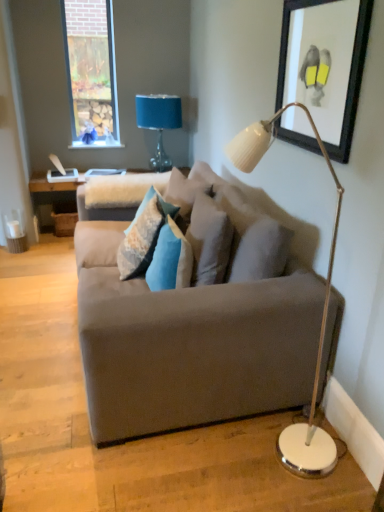
Question: From the image's perspective, is textured gray pillow at center, the first pillow in the right-to-left sequence, under blue fabric lampshade at upper center?

Choices:
 (A) no
 (B) yes

Answer: (B)

Question: Would you consider textured gray pillow at center, which appears as the 3th pillow when viewed from the left, to be distant from blue fabric lampshade at upper center?

Choices:
 (A) no
 (B) yes

Answer: (B)

Question: Is textured gray pillow at center, the first pillow in the right-to-left sequence, further to the viewer compared to blue fabric lampshade at upper center?

Choices:
 (A) no
 (B) yes

Answer: (A)

Question: Is the position of textured gray pillow at center, which appears as the 3th pillow when viewed from the left, less distant than that of blue fabric lampshade at upper center?

Choices:
 (A) no
 (B) yes

Answer: (B)

Question: Can you confirm if textured gray pillow at center, the first pillow in the right-to-left sequence, is bigger than blue fabric lampshade at upper center?

Choices:
 (A) no
 (B) yes

Answer: (A)

Question: Is textured gray pillow at center, which appears as the 3th pillow when viewed from the left, located outside blue fabric lampshade at upper center?

Choices:
 (A) no
 (B) yes

Answer: (B)

Question: From a real-world perspective, is suede gray couch at center positioned under blue velvet pillow at center, arranged as the 2th pillow when viewed from the left, based on gravity?

Choices:
 (A) yes
 (B) no

Answer: (A)

Question: Is suede gray couch at center turned away from blue velvet pillow at center, which is the 2th pillow from right to left?

Choices:
 (A) no
 (B) yes

Answer: (B)

Question: Can you confirm if suede gray couch at center is taller than blue velvet pillow at center, arranged as the 2th pillow when viewed from the left?

Choices:
 (A) no
 (B) yes

Answer: (B)

Question: Would you say suede gray couch at center is outside blue velvet pillow at center, arranged as the 2th pillow when viewed from the left?

Choices:
 (A) yes
 (B) no

Answer: (A)

Question: Does suede gray couch at center have a lesser height compared to blue velvet pillow at center, which is the 2th pillow from right to left?

Choices:
 (A) no
 (B) yes

Answer: (A)

Question: From the image's perspective, is suede gray couch at center below blue velvet pillow at center, which is the 2th pillow from right to left?

Choices:
 (A) no
 (B) yes

Answer: (A)

Question: Is white glossy floor lamp at right thinner than textured blue pillow at center, which ranks as the third pillow in right-to-left order?

Choices:
 (A) yes
 (B) no

Answer: (B)